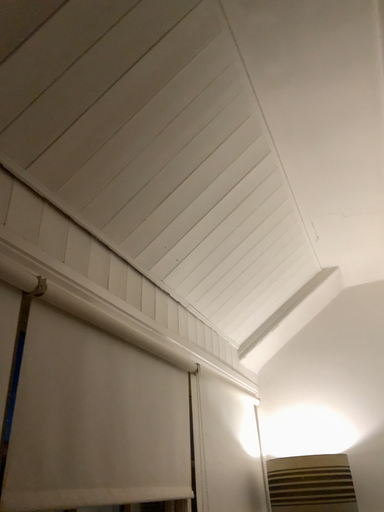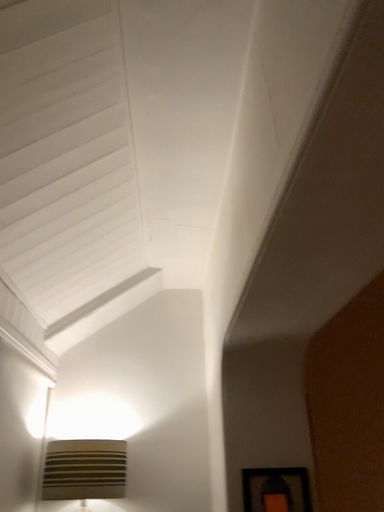
Question: How did the camera likely rotate when shooting the video?

Choices:
 (A) rotated left
 (B) rotated right

Answer: (B)